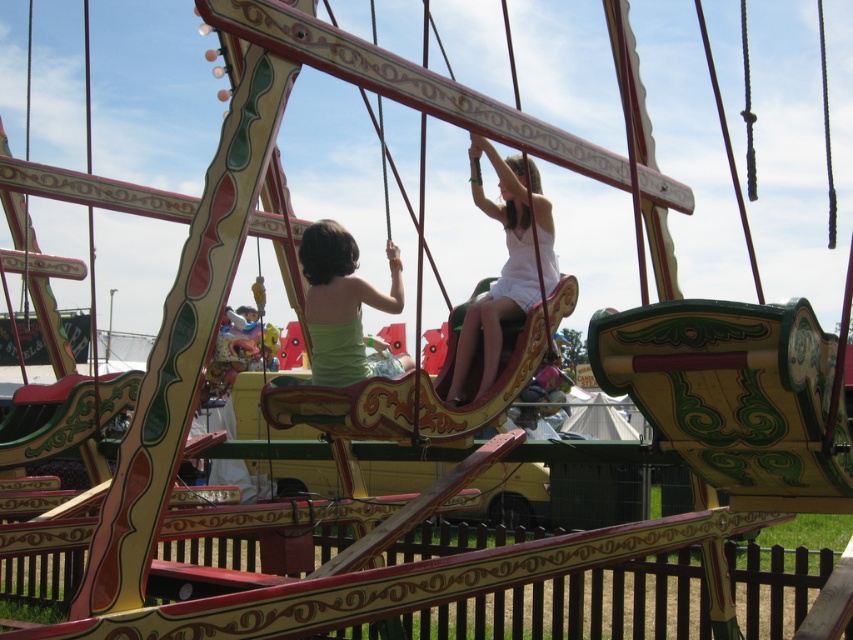
Who is more forward, (503, 205) or (316, 291)?

Point (316, 291) is in front.

Locate an element on the screen. This screenshot has height=640, width=853. white matte dress at upper center is located at coordinates (505, 262).